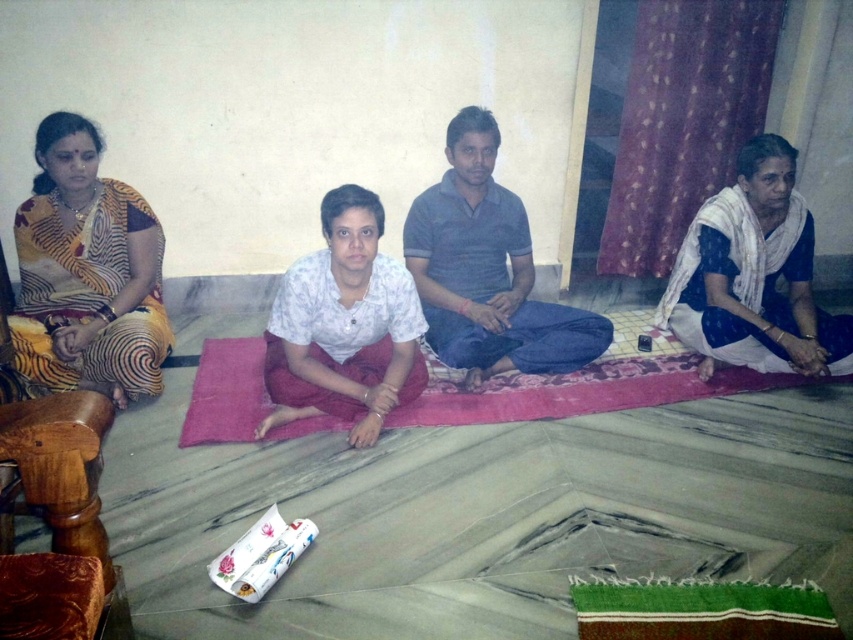
Question: Which point is farther from the camera taking this photo?

Choices:
 (A) (802, 241)
 (B) (305, 412)
 (C) (824, 380)

Answer: (C)

Question: Does dark blue cotton shirt at center have a greater width compared to white cotton shirt at center?

Choices:
 (A) yes
 (B) no

Answer: (A)

Question: Which point is closer to the camera?

Choices:
 (A) red fabric mat at center
 (B) white cotton saree at right
 (C) white cotton shirt at center
 (D) dark blue cotton shirt at center

Answer: (C)

Question: Which object is closer to the camera taking this photo?

Choices:
 (A) white cotton shirt at center
 (B) dark blue cotton shirt at center

Answer: (A)

Question: Does white cotton saree at right appear on the right side of red fabric mat at center?

Choices:
 (A) yes
 (B) no

Answer: (A)

Question: Does white cotton saree at right appear under white cotton shirt at center?

Choices:
 (A) no
 (B) yes

Answer: (A)